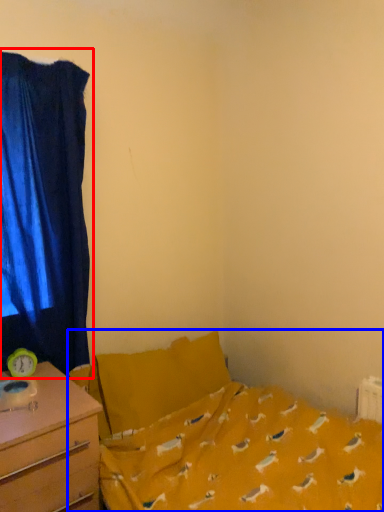
Question: Which point is further to the camera, curtain (highlighted by a red box) or bed (highlighted by a blue box)?

Choices:
 (A) curtain
 (B) bed

Answer: (A)